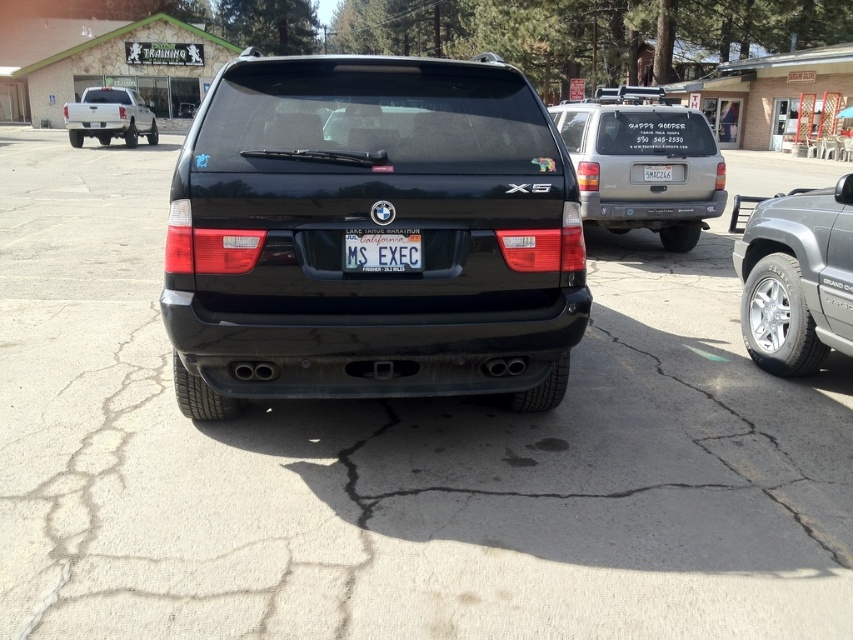
You are standing at the center of the parking lot and want to move towards the silver metallic truck at right. Which direction should you face to walk straight towards it?

Since the silver metallic truck at right is positioned at point 0.434 on the x axis, you should face towards the right side to walk straight towards it.